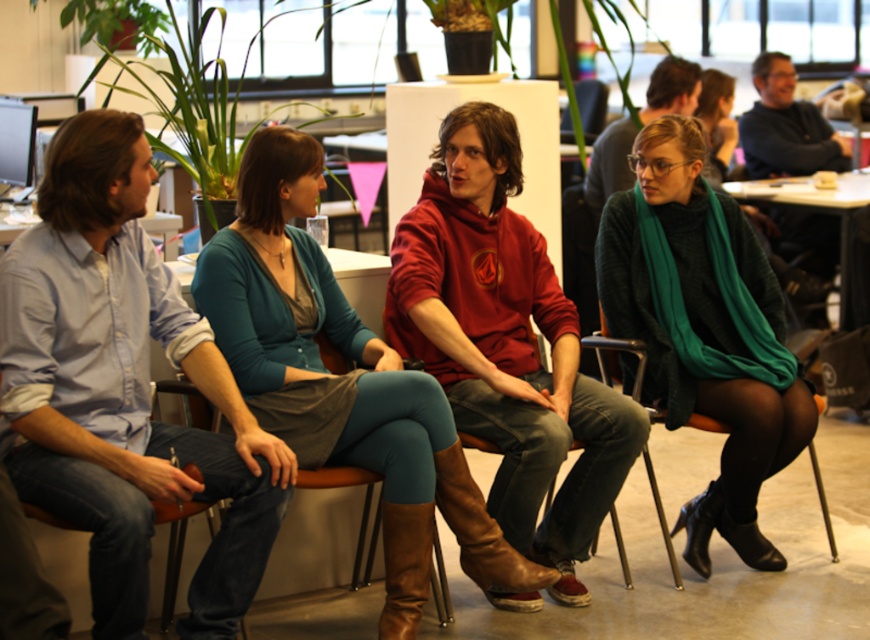
Who is lower down, red hoodie at center or green knitted scarf at center?

red hoodie at center

The height and width of the screenshot is (640, 870). I want to click on red hoodie at center, so click(x=506, y=344).

Does brown leather boot at center lie behind black leather boot at lower right?

No, it is not.

Is brown leather boot at center to the right of black leather boot at lower right from the viewer's perspective?

In fact, brown leather boot at center is to the left of black leather boot at lower right.

Is point (462, 452) less distant than point (673, 529)?

Yes.

At what (x,y) coordinates should I click in order to perform the action: click on brown leather boot at center. Please return your answer as a coordinate pair (x, y). The image size is (870, 640). Looking at the image, I should click on click(x=482, y=532).

Does point (266, 518) come in front of point (708, 525)?

Yes, point (266, 518) is closer to viewer.

This screenshot has height=640, width=870. In order to click on light blue shirt at left in this screenshot , I will do `click(124, 388)`.